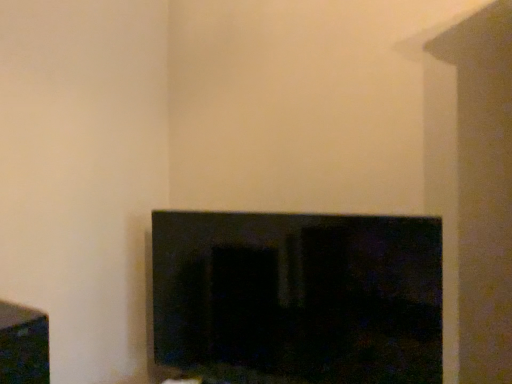
Describe the element at coordinates (298, 297) in the screenshot. I see `black glossy fireplace at center` at that location.

You are a GUI agent. You are given a task and a screenshot of the screen. Output one action in this format:
    pyautogui.click(x=<x>, y=<y>)
    Task: Click on the black glossy fireplace at center
    This screenshot has width=512, height=384.
    Given the screenshot: What is the action you would take?
    pyautogui.click(x=298, y=297)

Measure the distance between point (362, 353) and camera.

Point (362, 353) and camera are 1.35 meters apart from each other.

Where is `black glossy fireplace at center`? This screenshot has height=384, width=512. black glossy fireplace at center is located at coordinates (298, 297).